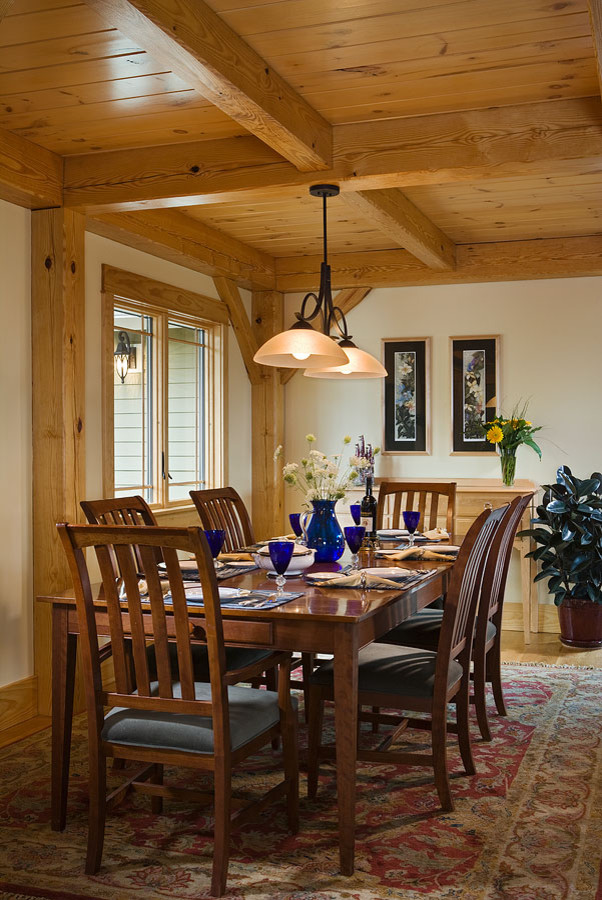
This screenshot has width=602, height=900. I want to click on rug, so [566, 795].